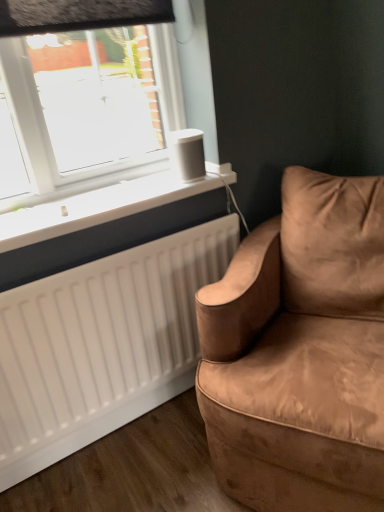
Question: Does suede brown couch at right come behind white matte speaker at upper center?

Choices:
 (A) yes
 (B) no

Answer: (B)

Question: Can you confirm if suede brown couch at right is taller than white matte speaker at upper center?

Choices:
 (A) yes
 (B) no

Answer: (A)

Question: Does suede brown couch at right have a lesser width compared to white matte speaker at upper center?

Choices:
 (A) no
 (B) yes

Answer: (A)

Question: Would you say suede brown couch at right contains white matte speaker at upper center?

Choices:
 (A) yes
 (B) no

Answer: (B)

Question: Is suede brown couch at right positioned with its back to white matte speaker at upper center?

Choices:
 (A) yes
 (B) no

Answer: (B)

Question: Choose the correct answer: Is white matte radiator at lower left inside white matte speaker at upper center or outside it?

Choices:
 (A) inside
 (B) outside

Answer: (B)

Question: In terms of size, does white matte radiator at lower left appear bigger or smaller than white matte speaker at upper center?

Choices:
 (A) small
 (B) big

Answer: (B)

Question: Is white matte radiator at lower left to the left or to the right of white matte speaker at upper center in the image?

Choices:
 (A) right
 (B) left

Answer: (B)

Question: Is point (99, 194) positioned closer to the camera than point (190, 157)?

Choices:
 (A) closer
 (B) farther

Answer: (B)

Question: From a real-world perspective, is suede brown couch at right positioned above or below white matte radiator at lower left?

Choices:
 (A) below
 (B) above

Answer: (A)

Question: Choose the correct answer: Is suede brown couch at right inside white matte radiator at lower left or outside it?

Choices:
 (A) outside
 (B) inside

Answer: (A)

Question: Visually, is suede brown couch at right positioned to the left or to the right of white matte radiator at lower left?

Choices:
 (A) right
 (B) left

Answer: (A)

Question: Is point (276, 358) positioned closer to the camera than point (84, 204)?

Choices:
 (A) closer
 (B) farther

Answer: (A)

Question: From a real-world perspective, is white matte speaker at upper center above or below white matte radiator at lower left?

Choices:
 (A) below
 (B) above

Answer: (B)

Question: From their relative heights in the image, would you say white matte speaker at upper center is taller or shorter than white matte radiator at lower left?

Choices:
 (A) short
 (B) tall

Answer: (B)